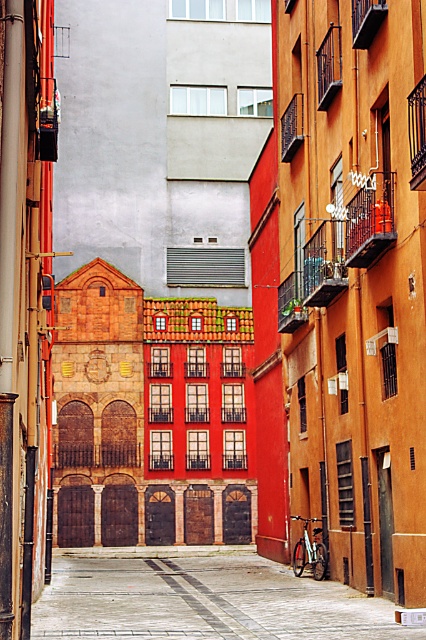
You are a delivery person trying to navigate through the alley. You need to move your delivery cart from the entrance to the end of the alley. The cart is 1.2 meters wide. Is there enough space between the smooth concrete pavement at center and the silver metallic bicycle at center to pass through?

The smooth concrete pavement at center is to the left of the silver metallic bicycle at center, but the description does not provide specific measurements about the distance between them. Therefore, it is unclear if there is sufficient space for the delivery cart to pass through.

You are a delivery person trying to navigate a narrow alleyway. You need to place a box on the smooth concrete pavement at center. However, there is a silver metallic bicycle at center in the way. Can you lift the box over the bicycle to place it on the pavement?

The smooth concrete pavement at center is taller than the silver metallic bicycle at center, so you can lift the box over the silver metallic bicycle at center and place it on the smooth concrete pavement at center.

From the picture: You are a delivery person trying to navigate through the alley. You see the smooth concrete pavement at center and the silver metallic bicycle at center. Which object is closer to the ground?

The smooth concrete pavement at center is closer to the ground because it is located below the silver metallic bicycle at center.